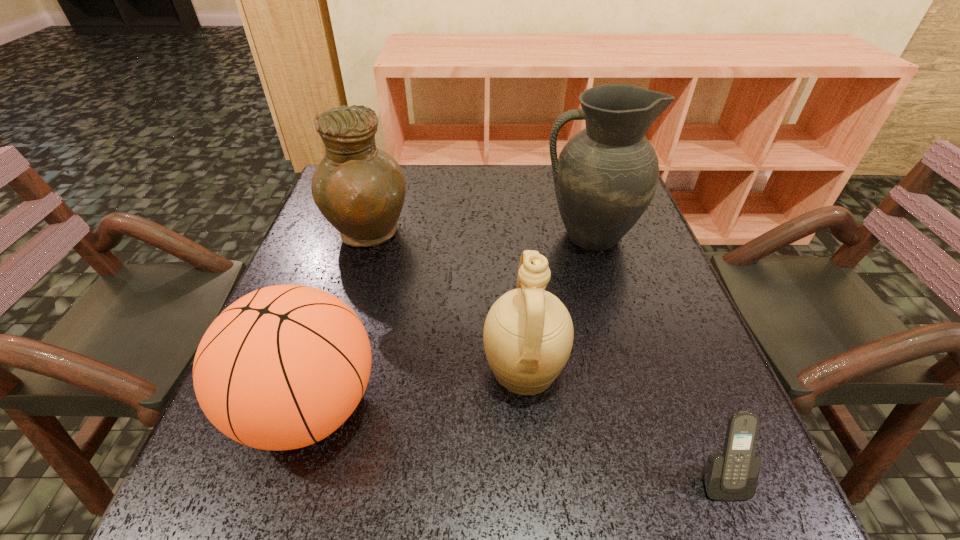
In order to click on the leftmost pitcher in this screenshot , I will do `click(360, 189)`.

In order to click on the shortest pitcher in this screenshot , I will do pyautogui.click(x=528, y=334).

Where is `basketball`? basketball is located at coordinates (283, 367).

Where is `cellular telephone`? cellular telephone is located at coordinates (733, 475).

Image resolution: width=960 pixels, height=540 pixels. I want to click on vacant area situated 0.180m at the spout of the leftmost pitcher, so click(483, 237).

What are the coordinates of `vacant space located 0.340m on the left of the shortest pitcher` in the screenshot? It's located at (296, 369).

Image resolution: width=960 pixels, height=540 pixels. What are the coordinates of `free space located on the back of the basketball` in the screenshot? It's located at (361, 240).

What are the coordinates of `basketball present at the near edge` in the screenshot? It's located at (283, 367).

Find the location of a particular element. cellular telephone located at the near edge is located at coordinates (733, 475).

Locate an element on the screen. The height and width of the screenshot is (540, 960). pitcher at the left edge is located at coordinates (360, 189).